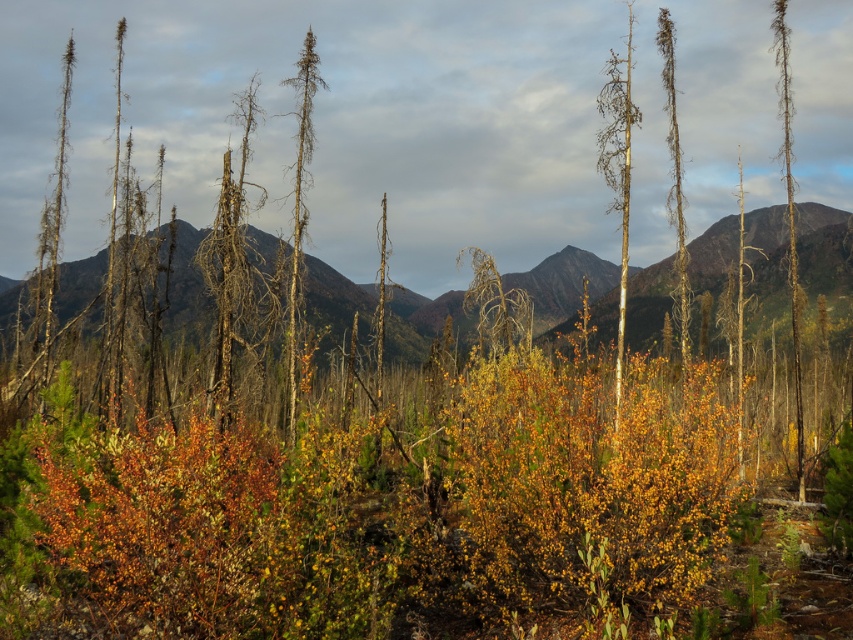
What do you see at coordinates (618, 173) in the screenshot?
I see `smooth silver tree at center` at bounding box center [618, 173].

Does smooth silver tree at center have a lesser width compared to brown bark tree at right?

Indeed, smooth silver tree at center has a lesser width compared to brown bark tree at right.

The width and height of the screenshot is (853, 640). What are the coordinates of `smooth silver tree at center` in the screenshot? It's located at click(618, 173).

Does rustic brown mountain at center have a greater height compared to dry wood tree at center?

Incorrect, rustic brown mountain at center's height is not larger of dry wood tree at center's.

In the scene shown: Can you confirm if rustic brown mountain at center is wider than dry wood tree at center?

Yes, rustic brown mountain at center is wider than dry wood tree at center.

This screenshot has height=640, width=853. I want to click on rustic brown mountain at center, so click(x=567, y=282).

Does rustic brown mountain at center come in front of brown dry wood at right?

No, it is not.

Is rustic brown mountain at center above brown dry wood at right?

Actually, rustic brown mountain at center is below brown dry wood at right.

This screenshot has width=853, height=640. In order to click on rustic brown mountain at center in this screenshot , I will do `click(567, 282)`.